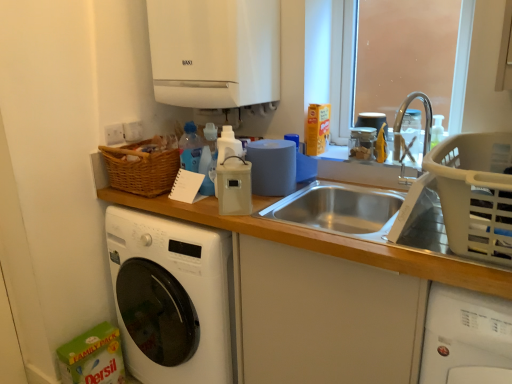
Describe the element at coordinates (475, 193) in the screenshot. I see `gray plastic basket at right` at that location.

This screenshot has width=512, height=384. What do you see at coordinates (215, 52) in the screenshot?
I see `white glossy boiler at upper center, the 1th appliance in the top-to-bottom sequence` at bounding box center [215, 52].

This screenshot has height=384, width=512. What do you see at coordinates (234, 186) in the screenshot?
I see `beige plastic container at center, placed as the 2th appliance when sorted from back to front` at bounding box center [234, 186].

What is the approximate width of white plastic washing machine at lower right, the 2th washing machine viewed from the left?

white plastic washing machine at lower right, the 2th washing machine viewed from the left, is 25.48 inches wide.

How much space does white glossy washing machine at lower left, the second washing machine viewed from the right, occupy vertically?

The height of white glossy washing machine at lower left, the second washing machine viewed from the right, is 33.95 inches.

Describe the element at coordinates (172, 297) in the screenshot. I see `white glossy washing machine at lower left, the second washing machine viewed from the right` at that location.

Locate an element on the screen. The height and width of the screenshot is (384, 512). translucent plastic window screen at upper right is located at coordinates (404, 56).

Identify the location of gray plastic basket at right. (475, 193).

Is white glossy boiler at upper center, placed as the first appliance when sorted from back to front, facing towards beige plastic container at center, the 1th appliance ordered from the bottom?

No.

Is white glossy boiler at upper center, which ranks as the 2th appliance in bottom-to-top order, outside of beige plastic container at center, placed as the 2th appliance when sorted from back to front?

white glossy boiler at upper center, which ranks as the 2th appliance in bottom-to-top order, lies outside beige plastic container at center, placed as the 2th appliance when sorted from back to front,'s area.

Is point (251, 79) closer to viewer compared to point (244, 177)?

No, (251, 79) is further to viewer.

From the image's perspective, between white glossy boiler at upper center, which ranks as the 2th appliance in bottom-to-top order, and beige plastic container at center, which ranks as the 2th appliance in top-to-bottom order, which one is located above?

From the image's view, white glossy boiler at upper center, which ranks as the 2th appliance in bottom-to-top order, is above.

Is beige plastic container at center, which is counted as the first appliance, starting from the front, smaller than white plastic washing machine at lower right, the first washing machine positioned from the right?

Yes, beige plastic container at center, which is counted as the first appliance, starting from the front, is smaller than white plastic washing machine at lower right, the first washing machine positioned from the right.

Does beige plastic container at center, which ranks as the 2th appliance in top-to-bottom order, appear on the right side of white plastic washing machine at lower right, the first washing machine positioned from the right?

No.

Which object is more forward, beige plastic container at center, which ranks as the 2th appliance in top-to-bottom order, or white plastic washing machine at lower right, the 2th washing machine viewed from the left?

white plastic washing machine at lower right, the 2th washing machine viewed from the left, is in front.

From a real-world perspective, is beige plastic container at center, which ranks as the 2th appliance in top-to-bottom order, physically above white plastic washing machine at lower right, the 2th washing machine viewed from the left?

Yes, from a real-world perspective, beige plastic container at center, which ranks as the 2th appliance in top-to-bottom order, is over white plastic washing machine at lower right, the 2th washing machine viewed from the left

Would you say white glossy washing machine at lower left, the second washing machine viewed from the right, contains gray plastic basket at right?

No.

Is point (173, 339) more distant than point (492, 133)?

Yes, point (173, 339) is farther from viewer.

From a real-world perspective, is white glossy washing machine at lower left, the second washing machine viewed from the right, over gray plastic basket at right?

No.

Consider the image. Which of these two, white glossy washing machine at lower left, the 1th washing machine from the left, or gray plastic basket at right, stands shorter?

gray plastic basket at right.

I want to click on window screen that appears above the white glossy washing machine at lower left, the second washing machine viewed from the right (from the image's perspective), so click(x=404, y=56).

Who is bigger, translucent plastic window screen at upper right or white glossy washing machine at lower left, the second washing machine viewed from the right?

With larger size is white glossy washing machine at lower left, the second washing machine viewed from the right.

Is white glossy washing machine at lower left, the second washing machine viewed from the right, inside translucent plastic window screen at upper right?

Actually, white glossy washing machine at lower left, the second washing machine viewed from the right, is outside translucent plastic window screen at upper right.

Is beige plastic container at center, which is counted as the first appliance, starting from the front, aimed at translucent plastic window screen at upper right?

No, beige plastic container at center, which is counted as the first appliance, starting from the front, does not turn towards translucent plastic window screen at upper right.

Looking at this image, based on their positions, is beige plastic container at center, which ranks as the 2th appliance in top-to-bottom order, located to the left or right of translucent plastic window screen at upper right?

beige plastic container at center, which ranks as the 2th appliance in top-to-bottom order, is to the left of translucent plastic window screen at upper right.

The height and width of the screenshot is (384, 512). I want to click on appliance below the translucent plastic window screen at upper right (from a real-world perspective), so click(234, 186).

From the picture: Is beige plastic container at center, which is counted as the first appliance, starting from the front, next to translucent plastic window screen at upper right?

beige plastic container at center, which is counted as the first appliance, starting from the front, is not next to translucent plastic window screen at upper right, and they're not touching.

From the image's perspective, is translucent plastic window screen at upper right on top of gray plastic basket at right?

Yes.

In terms of size, does translucent plastic window screen at upper right appear bigger or smaller than gray plastic basket at right?

translucent plastic window screen at upper right is smaller than gray plastic basket at right.

Consider the image. From a real-world perspective, does translucent plastic window screen at upper right sit lower than gray plastic basket at right?

Incorrect, from a real-world perspective, translucent plastic window screen at upper right is higher than gray plastic basket at right.

Is translucent plastic window screen at upper right situated inside gray plastic basket at right or outside?

translucent plastic window screen at upper right is outside gray plastic basket at right.

Which point is more distant from viewer, (199, 283) or (467, 318)?

Point (199, 283)

Is white plastic washing machine at lower right, the 2th washing machine viewed from the left, at the back of white glossy washing machine at lower left, the 1th washing machine from the left?

No, white plastic washing machine at lower right, the 2th washing machine viewed from the left, is not at the back of white glossy washing machine at lower left, the 1th washing machine from the left.

Considering the positions of objects white glossy washing machine at lower left, the second washing machine viewed from the right, and white plastic washing machine at lower right, the 2th washing machine viewed from the left, in the image provided, who is behind, white glossy washing machine at lower left, the second washing machine viewed from the right, or white plastic washing machine at lower right, the 2th washing machine viewed from the left,?

white glossy washing machine at lower left, the second washing machine viewed from the right.

Considering the sizes of objects white glossy washing machine at lower left, the 1th washing machine from the left, and white plastic washing machine at lower right, the first washing machine positioned from the right, in the image provided, who is thinner, white glossy washing machine at lower left, the 1th washing machine from the left, or white plastic washing machine at lower right, the first washing machine positioned from the right,?

Thinner between the two is white plastic washing machine at lower right, the first washing machine positioned from the right.

At what (x,y) coordinates should I click in order to perform the action: click on appliance lying on the right of white glossy boiler at upper center, placed as the first appliance when sorted from back to front. Please return your answer as a coordinate pair (x, y). Looking at the image, I should click on (234, 186).

The width and height of the screenshot is (512, 384). In order to click on appliance that is the 1st object above the white plastic washing machine at lower right, the 2th washing machine viewed from the left (from a real-world perspective) in this screenshot , I will do `click(234, 186)`.

Looking at the image, which one is located closer to gray plastic basket at right, white plastic washing machine at lower right, the first washing machine positioned from the right, or translucent plastic window screen at upper right?

Among the two, white plastic washing machine at lower right, the first washing machine positioned from the right, is located nearer to gray plastic basket at right.

Which object lies nearer to the anchor point white glossy boiler at upper center, placed as the first appliance when sorted from back to front, white plastic washing machine at lower right, the 2th washing machine viewed from the left, or white glossy washing machine at lower left, the second washing machine viewed from the right?

white glossy washing machine at lower left, the second washing machine viewed from the right, is positioned closer to the anchor white glossy boiler at upper center, placed as the first appliance when sorted from back to front.

Based on their spatial positions, is beige plastic container at center, the 1th appliance ordered from the bottom, or gray plastic basket at right closer to white glossy washing machine at lower left, the 1th washing machine from the left?

beige plastic container at center, the 1th appliance ordered from the bottom, lies closer to white glossy washing machine at lower left, the 1th washing machine from the left, than the other object.

Looking at the image, which one is located closer to white glossy boiler at upper center, placed as the first appliance when sorted from back to front, gray plastic basket at right or translucent plastic window screen at upper right?

The object closer to white glossy boiler at upper center, placed as the first appliance when sorted from back to front, is gray plastic basket at right.

Which object lies nearer to the anchor point white plastic washing machine at lower right, the 2th washing machine viewed from the left, white glossy washing machine at lower left, the 1th washing machine from the left, or gray plastic basket at right?

gray plastic basket at right is closer to white plastic washing machine at lower right, the 2th washing machine viewed from the left.

Considering their positions, is white glossy washing machine at lower left, the 1th washing machine from the left, positioned further to white plastic washing machine at lower right, the first washing machine positioned from the right, than white glossy boiler at upper center, the 1th appliance in the top-to-bottom sequence?

white glossy boiler at upper center, the 1th appliance in the top-to-bottom sequence, lies further to white plastic washing machine at lower right, the first washing machine positioned from the right, than the other object.

Which object lies further to the anchor point gray plastic basket at right, beige plastic container at center, which is counted as the first appliance, starting from the front, or white plastic washing machine at lower right, the first washing machine positioned from the right?

Among the two, beige plastic container at center, which is counted as the first appliance, starting from the front, is located further to gray plastic basket at right.

Estimate the real-world distances between objects in this image. Which object is further from white glossy washing machine at lower left, the second washing machine viewed from the right, white glossy boiler at upper center, the 1th appliance in the top-to-bottom sequence, or white plastic washing machine at lower right, the 2th washing machine viewed from the left?

white plastic washing machine at lower right, the 2th washing machine viewed from the left, is further to white glossy washing machine at lower left, the second washing machine viewed from the right.

Where is `washing machine between white glossy boiler at upper center, which ranks as the 2th appliance in bottom-to-top order, and white plastic washing machine at lower right, the first washing machine positioned from the right, from top to bottom`? The width and height of the screenshot is (512, 384). washing machine between white glossy boiler at upper center, which ranks as the 2th appliance in bottom-to-top order, and white plastic washing machine at lower right, the first washing machine positioned from the right, from top to bottom is located at coordinates pyautogui.click(x=172, y=297).

Locate an element on the screen. appliance between white glossy boiler at upper center, placed as the first appliance when sorted from back to front, and white glossy washing machine at lower left, the second washing machine viewed from the right, vertically is located at coordinates (234, 186).

This screenshot has height=384, width=512. In order to click on appliance between white glossy boiler at upper center, which is the 2th appliance from front to back, and white plastic washing machine at lower right, the first washing machine positioned from the right, from top to bottom in this screenshot , I will do `click(234, 186)`.

The height and width of the screenshot is (384, 512). In order to click on window screen situated between white glossy boiler at upper center, which is the 2th appliance from front to back, and gray plastic basket at right from left to right in this screenshot , I will do `click(404, 56)`.